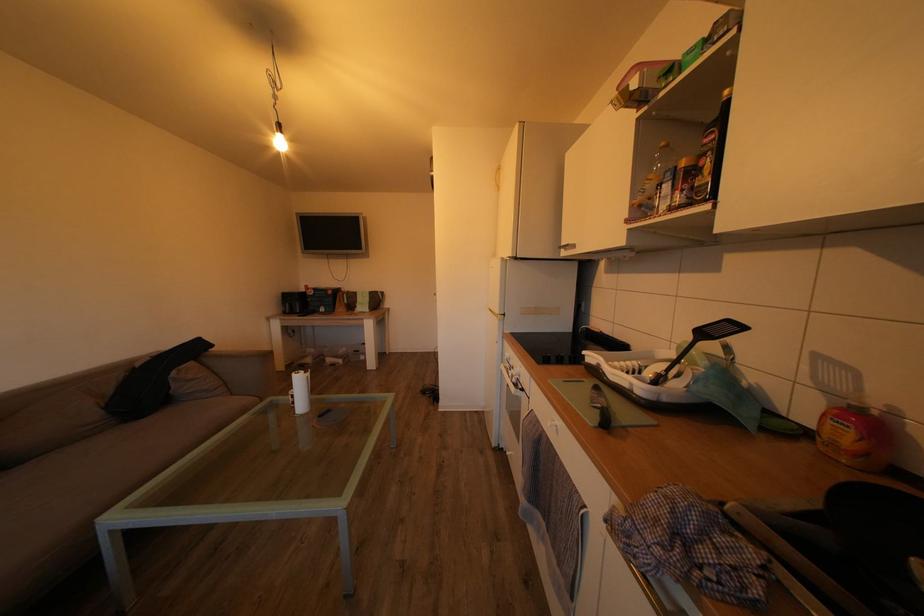
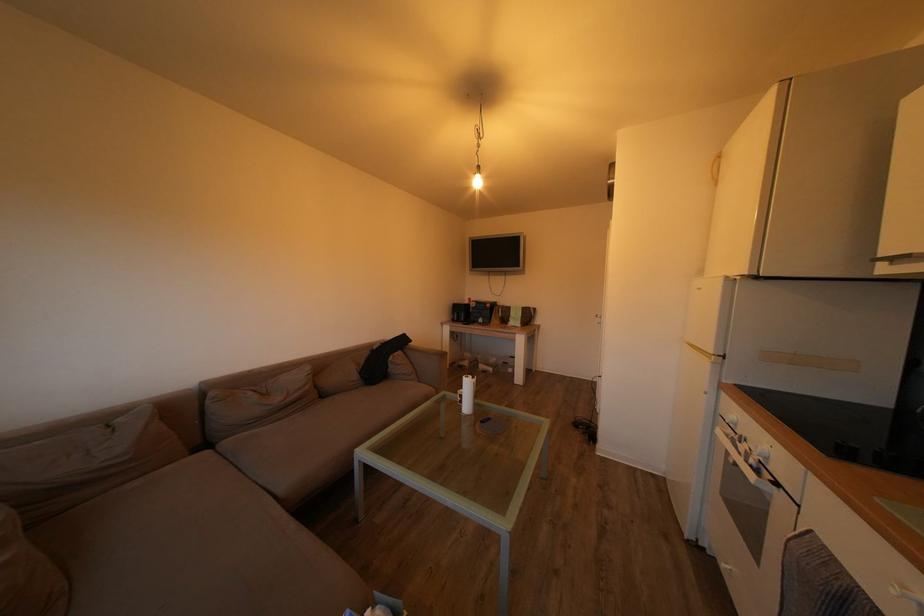
Locate, in the second image, the point that corresponds to the point at 280,313 in the first image.

(453, 320)